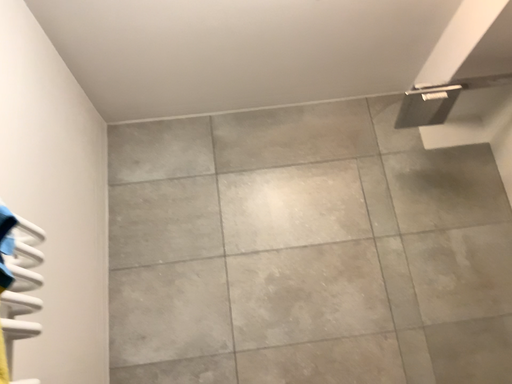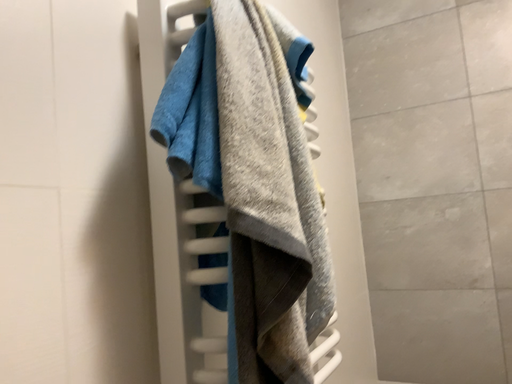
Question: How did the camera likely rotate when shooting the video?

Choices:
 (A) rotated upward
 (B) rotated downward

Answer: (B)